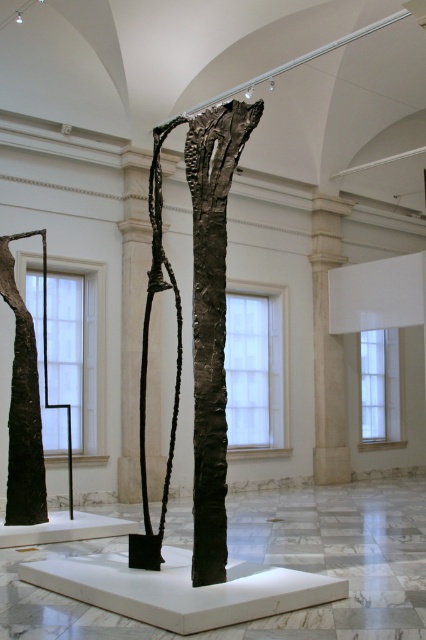
From the picture: You are an art curator planning to install a new light fixture above the light beige stone column at center and the black textured tree trunk at left. Which object requires a higher ceiling clearance due to its height?

The black textured tree trunk at left requires higher ceiling clearance because it is taller than the light beige stone column at center.

You are an interior designer planning to place a new sculpture in this gallery. You have a sculpture that is 1.2 meters wide. The light beige stone column at center and the black textured tree trunk at left are already present. Which existing object can the new sculpture fit next to without exceeding its width?

The light beige stone column at center has a lesser width compared to the black textured tree trunk at left. Since the new sculpture is 1.2 meters wide, it can fit next to the light beige stone column at center as it is narrower.

You are an art curator planning to move the dark bronze sculpture at center and the black textured tree trunk at left to a new exhibition space. The new space has a 100 cm height restriction. Which object might exceed the height limit if the sculpture is 120 cm tall?

The dark bronze sculpture at center is bigger than the black textured tree trunk at left. Since the sculpture is 120 cm tall, it exceeds the 100 cm height restriction, while the tree trunk, being smaller, might fit within the limit.